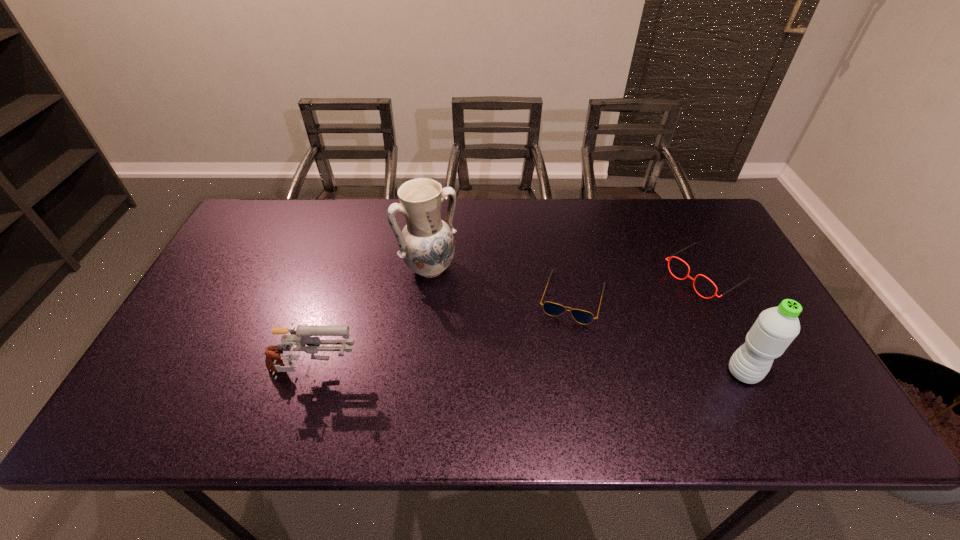
Image resolution: width=960 pixels, height=540 pixels. What are the coordinates of `water bottle at the right edge` in the screenshot? It's located at (775, 328).

This screenshot has width=960, height=540. In order to click on spectacles located in the right edge section of the desktop in this screenshot , I will do `click(672, 256)`.

Where is `object situated at the near right corner`? object situated at the near right corner is located at coordinates (775, 328).

This screenshot has width=960, height=540. In the image, there is a desktop. Identify the location of free space at the far edge. [x=591, y=206].

At what (x,y) coordinates should I click in order to perform the action: click on vacant space at the near edge of the desktop. Please return your answer as a coordinate pair (x, y). The height and width of the screenshot is (540, 960). Looking at the image, I should click on (237, 389).

Locate an element on the screen. The image size is (960, 540). free region at the left edge of the desktop is located at coordinates (204, 308).

The width and height of the screenshot is (960, 540). Find the location of `vacant space at the right edge of the desktop`. vacant space at the right edge of the desktop is located at coordinates (700, 288).

The height and width of the screenshot is (540, 960). What are the coordinates of `vacant space at the far left corner of the desktop` in the screenshot? It's located at (275, 208).

At what (x,y) coordinates should I click in order to perform the action: click on free region at the near left corner of the desktop. Please return your answer as a coordinate pair (x, y). Looking at the image, I should click on (183, 390).

Where is `vacant region between the leftmost object and the second shortest object`? Image resolution: width=960 pixels, height=540 pixels. vacant region between the leftmost object and the second shortest object is located at coordinates (510, 325).